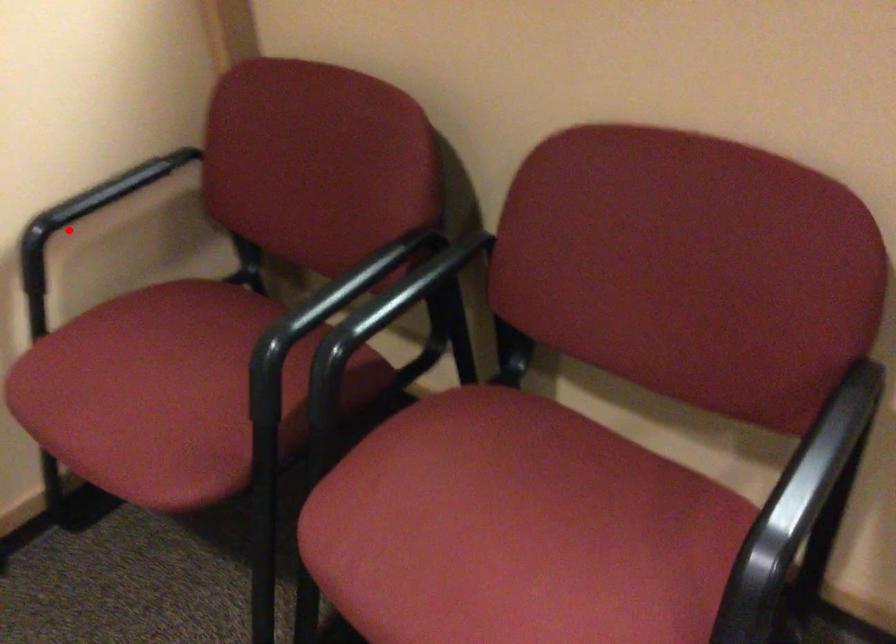
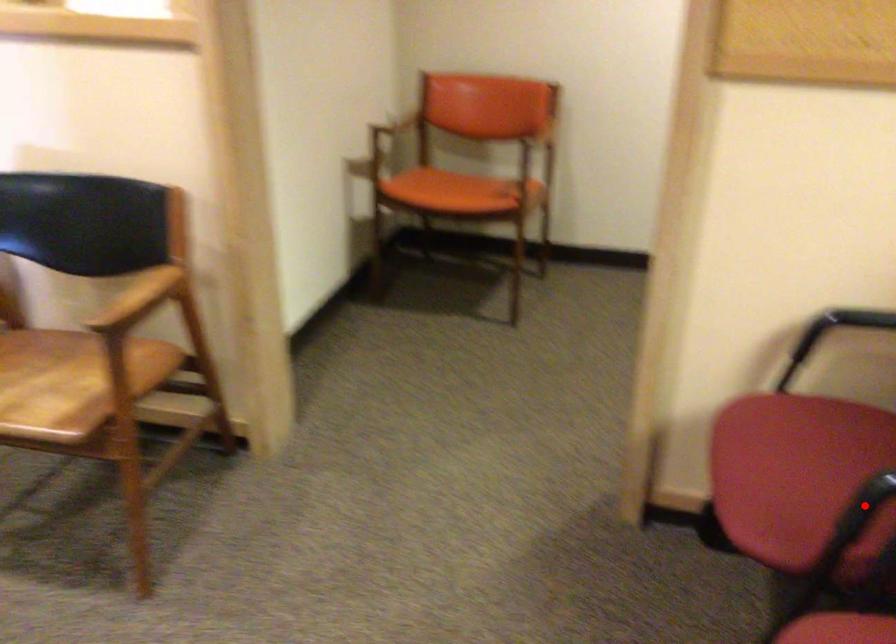
I am providing you with two images of the same scene from different viewpoints. A red point is marked on the first image and another point is marked on the second image. Is the red point in image1 aligned with the point shown in image2?

No